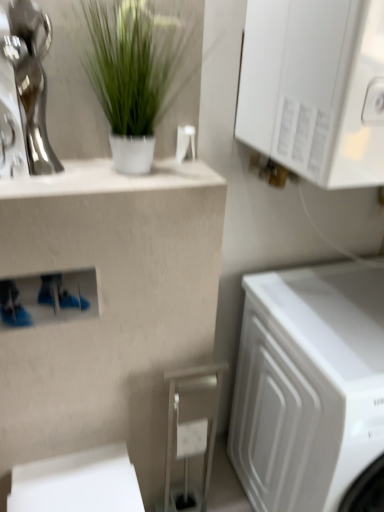
The height and width of the screenshot is (512, 384). In order to click on free space on the front side of shiny silver statue at upper left in this screenshot , I will do point(31,183).